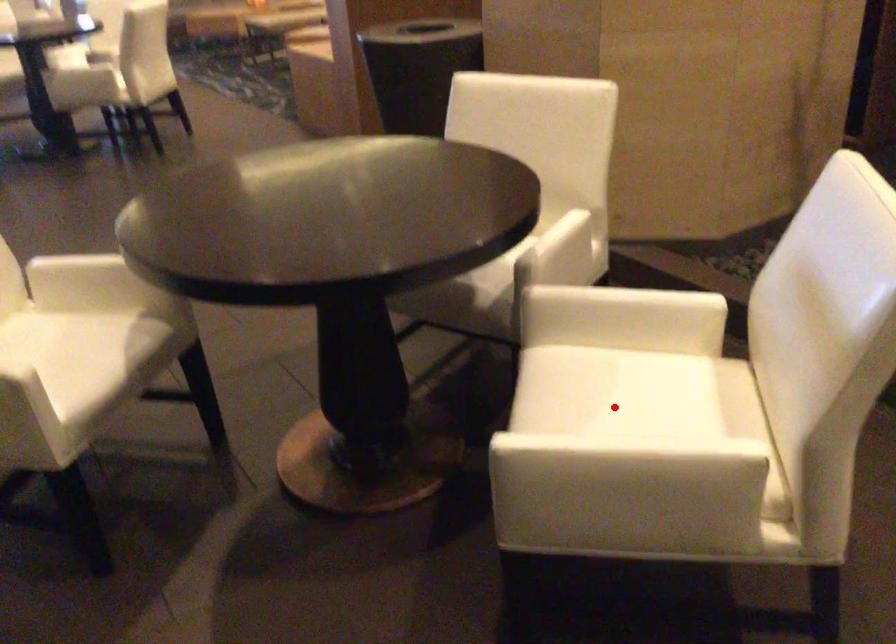
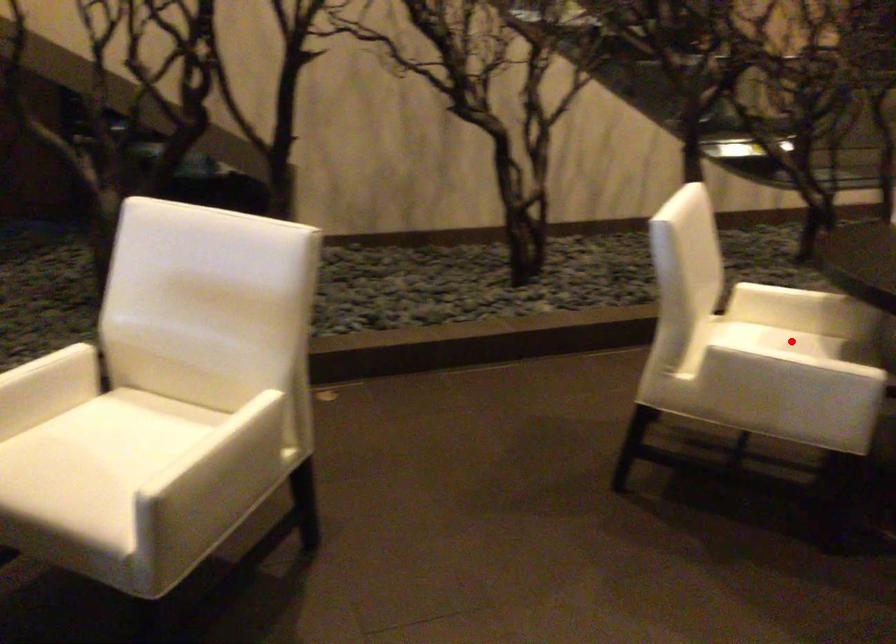
I am providing you with two images of the same scene from different viewpoints. A red point is marked on the first image and another point is marked on the second image. Is the marked point in image1 the same physical position as the marked point in image2?

No